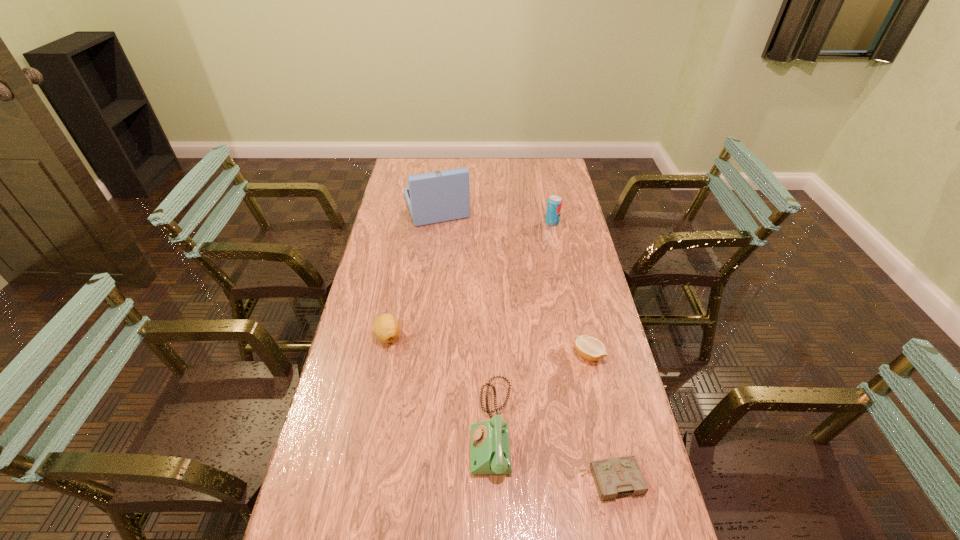
Where is `free region located on the dial of the third object from left to right`? free region located on the dial of the third object from left to right is located at coordinates pos(384,428).

Identify the location of vacant area situated on the dial of the third object from left to right. pos(425,428).

The image size is (960, 540). Find the location of `free space located 0.090m at the stem end of the left lemon`. free space located 0.090m at the stem end of the left lemon is located at coordinates (381, 374).

You are a GUI agent. You are given a task and a screenshot of the screen. Output one action in this format:
    pyautogui.click(x=<x>, y=<y>)
    Task: Click on the free point located on the back of the right lemon
    
    Given the screenshot: What is the action you would take?
    pyautogui.click(x=574, y=289)

Where is `vacant space situated 0.260m on the left of the shortest object`? This screenshot has width=960, height=540. vacant space situated 0.260m on the left of the shortest object is located at coordinates (473, 480).

Locate an element on the screen. This screenshot has height=540, width=960. phonograph record located in the left edge section of the desktop is located at coordinates (440, 196).

The width and height of the screenshot is (960, 540). Find the location of `lemon that is at the left edge`. lemon that is at the left edge is located at coordinates (386, 327).

This screenshot has width=960, height=540. What are the coordinates of `soda can positioned at the right edge` in the screenshot? It's located at (554, 204).

The width and height of the screenshot is (960, 540). In order to click on lemon located at the right edge in this screenshot , I will do `click(590, 348)`.

Image resolution: width=960 pixels, height=540 pixels. I want to click on diary that is at the right edge, so click(x=619, y=476).